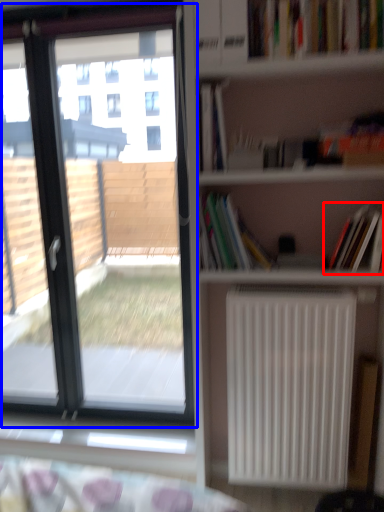
Question: Which of the following is the closest to the observer, book (highlighted by a red box) or window (highlighted by a blue box)?

Choices:
 (A) book
 (B) window

Answer: (A)